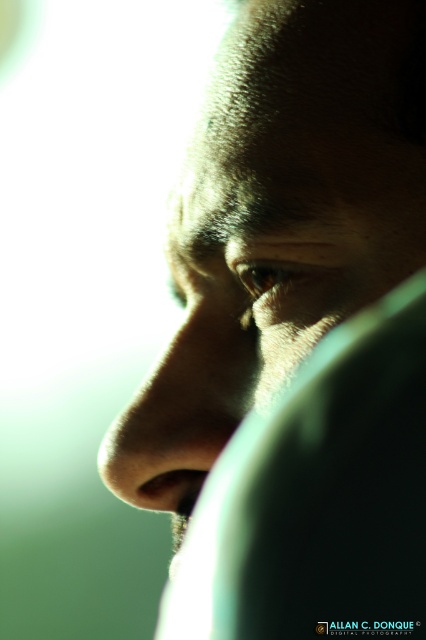
You are a photographer adjusting the focus of a camera. You notice the matte skin face at center and the matte skin nose at center in your viewfinder. Which object should you focus on to ensure the nose is clearly visible?

The matte skin face at center is in front of the matte skin nose at center. Therefore, focusing on the matte skin face at center will ensure the nose is also in focus since it is closer to the camera.

You are a photographer adjusting lighting for a portrait. You need to ensure that the matte skin nose at center is fully visible under the matte skin face at center. Based on the scene, is there a risk that the nose might be obscured by the face?

The matte skin face at center is positioned over matte skin nose at center, so there is a risk that the nose might be obscured by the face.

You are a photographer adjusting the lighting for a portrait. You notice the matte skin face at center and the matte skin nose at center. Which object is positioned to the right in the image?

The matte skin face at center is positioned to the right of the matte skin nose at center according to the description.